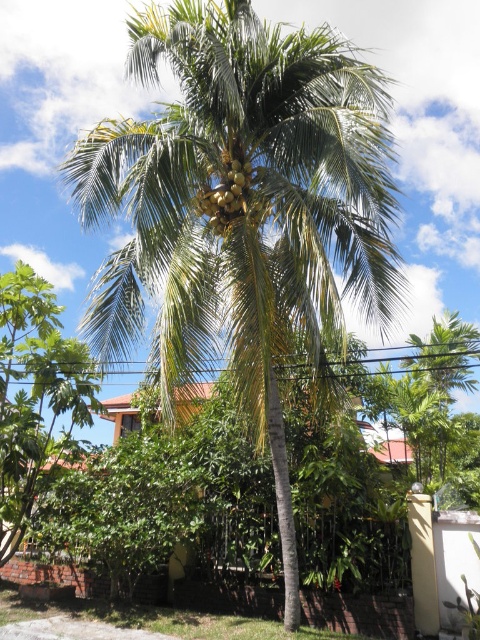
You are standing in a tropical garden and want to pick a coconut from the green leafy coconut tree at center. The coconuts are located at the top of the tree. If you have a ladder that is 5 meters tall, will it be sufficient to reach the coconuts?

The green leafy coconut tree at center and viewer are 5.67 meters apart. Since the ladder is only 5 meters tall, it will not be sufficient to reach the coconuts at the top of the tree.

You are a botanist examining the tropical scene. You notice the green leafy coconut tree at center and the green matte coconut at center. Which object occupies more space in the image?

The green leafy coconut tree at center has a larger size compared to the green matte coconut at center, so it occupies more space in the image.